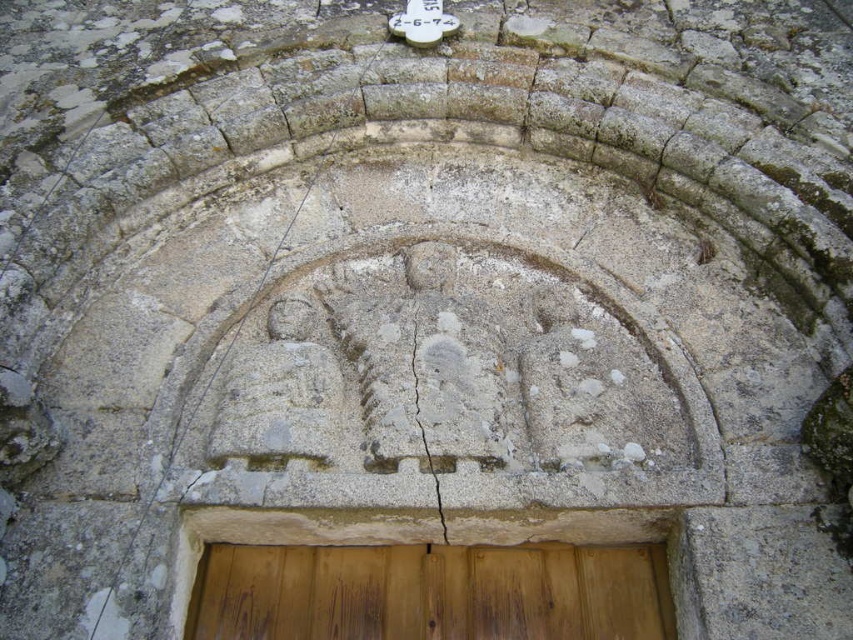
Does point (636, 612) come behind point (415, 332)?

No, it is in front of (415, 332).

Looking at this image, can you confirm if wooden door at center is positioned to the left of cracked stone at center?

Incorrect, wooden door at center is not on the left side of cracked stone at center.

Who is more forward, (308,579) or (432,476)?

Positioned in front is point (432,476).

The width and height of the screenshot is (853, 640). I want to click on wooden door at center, so click(431, 593).